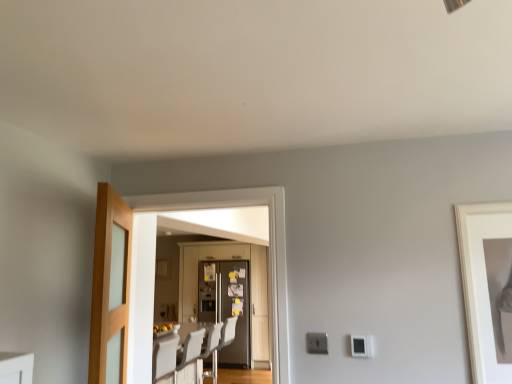
Describe the element at coordinates (228, 307) in the screenshot. The width and height of the screenshot is (512, 384). I see `metallic gray refrigerator at center` at that location.

Measure the distance between white plastic light switch at lower right and camera.

The depth of white plastic light switch at lower right is 5.92 feet.

What do you see at coordinates (222, 345) in the screenshot? I see `white plastic swivel chair at center` at bounding box center [222, 345].

Find the location of a particular element. Image resolution: width=512 pixels, height=384 pixels. white plastic swivel chair at center is located at coordinates (222, 345).

The image size is (512, 384). What are the coordinates of `white glossy dining table at center` in the screenshot? It's located at (192, 351).

Where is `white matte picture frame at right`? white matte picture frame at right is located at coordinates (481, 283).

This screenshot has height=384, width=512. I want to click on matte glass door at center, placed as the 2th door when sorted from front to back, so click(153, 269).

In the scene shown: Does metallic silver refrigerator at center, the 1th door in the back-to-front sequence, touch white matte picture frame at right?

No, metallic silver refrigerator at center, the 1th door in the back-to-front sequence, is not with white matte picture frame at right.

Is point (255, 308) farther from viewer compared to point (472, 251)?

Yes, it is.

Is metallic silver refrigerator at center, placed as the third door when sorted from front to back, turned away from white matte picture frame at right?

No, metallic silver refrigerator at center, placed as the third door when sorted from front to back, is not facing away from white matte picture frame at right.

Visually, is metallic silver refrigerator at center, the 1th door in the back-to-front sequence, positioned to the left or to the right of white matte picture frame at right?

Based on their positions, metallic silver refrigerator at center, the 1th door in the back-to-front sequence, is located to the left of white matte picture frame at right.

Would you consider white plastic light switch at lower right to be distant from metallic gray refrigerator at center?

Yes, white plastic light switch at lower right is far from metallic gray refrigerator at center.

Is white plastic light switch at lower right turned away from metallic gray refrigerator at center?

white plastic light switch at lower right is not turned away from metallic gray refrigerator at center.

Do you think white plastic light switch at lower right is within metallic gray refrigerator at center, or outside of it?

white plastic light switch at lower right is not inside metallic gray refrigerator at center, it's outside.

Between white plastic light switch at lower right and metallic gray refrigerator at center, which one appears on the left side from the viewer's perspective?

Positioned to the left is metallic gray refrigerator at center.

Which is correct: matte glass door at center, placed as the 2th door when sorted from front to back, is inside white glossy dining table at center, or outside of it?

matte glass door at center, placed as the 2th door when sorted from front to back, is located beyond the bounds of white glossy dining table at center.

Which object is thinner, matte glass door at center, the 2th door when ordered from back to front, or white glossy dining table at center?

matte glass door at center, the 2th door when ordered from back to front, is thinner.

Locate an element on the screen. The width and height of the screenshot is (512, 384). furniture below the matte glass door at center, placed as the 2th door when sorted from front to back (from a real-world perspective) is located at coordinates (192, 351).

From the image's perspective, is white plastic light switch at lower right located beneath matte glass door at center, the 2th door when ordered from back to front?

Yes, from the image's perspective, white plastic light switch at lower right is below matte glass door at center, the 2th door when ordered from back to front.

Consider the image. Would you consider white plastic light switch at lower right to be distant from matte glass door at center, placed as the 2th door when sorted from front to back?

No.

Is white plastic light switch at lower right to the left of matte glass door at center, placed as the 2th door when sorted from front to back, from the viewer's perspective?

No, white plastic light switch at lower right is not to the left of matte glass door at center, placed as the 2th door when sorted from front to back.

Is white plastic light switch at lower right not within matte glass door at center, placed as the 2th door when sorted from front to back?

Yes, white plastic light switch at lower right is not within matte glass door at center, placed as the 2th door when sorted from front to back.

Is there a large distance between white plastic chair at center and white plastic light switch at lower right?

Absolutely, white plastic chair at center is distant from white plastic light switch at lower right.

Is white plastic chair at center in front of or behind white plastic light switch at lower right in the image?

Visually, white plastic chair at center is located behind white plastic light switch at lower right.

Find the location of a particular element. chair below the white plastic light switch at lower right (from the image's perspective) is located at coordinates (165, 358).

Is white plastic chair at center shorter than white plastic light switch at lower right?

In fact, white plastic chair at center may be taller than white plastic light switch at lower right.

Is white matte picture frame at right shorter than white glossy dining table at center?

Indeed, white matte picture frame at right has a lesser height compared to white glossy dining table at center.

Where is `furniture behind the white matte picture frame at right`? Image resolution: width=512 pixels, height=384 pixels. furniture behind the white matte picture frame at right is located at coordinates (192, 351).

Is white matte picture frame at right outside of white glossy dining table at center?

Yes, white matte picture frame at right is outside of white glossy dining table at center.

Is white matte picture frame at right not near white glossy dining table at center?

Indeed, white matte picture frame at right is not near white glossy dining table at center.

From a real-world perspective, which is physically above, metallic silver refrigerator at center, the 1th door in the back-to-front sequence, or white glossy dining table at center?

From a 3D spatial view, metallic silver refrigerator at center, the 1th door in the back-to-front sequence, is above.

Are metallic silver refrigerator at center, placed as the third door when sorted from front to back, and white glossy dining table at center beside each other?

metallic silver refrigerator at center, placed as the third door when sorted from front to back, is not next to white glossy dining table at center, and they're not touching.

From the image's perspective, which is below, metallic silver refrigerator at center, placed as the third door when sorted from front to back, or white glossy dining table at center?

white glossy dining table at center appears lower in the image.

Considering the sizes of metallic silver refrigerator at center, placed as the third door when sorted from front to back, and white glossy dining table at center in the image, is metallic silver refrigerator at center, placed as the third door when sorted from front to back, taller or shorter than white glossy dining table at center?

In the image, metallic silver refrigerator at center, placed as the third door when sorted from front to back, appears to be taller than white glossy dining table at center.

Identify the location of the 2nd door positioned below the white matte picture frame at right (from a real-world perspective). The width and height of the screenshot is (512, 384). (250, 288).

In order to click on light switch on the right of metallic gray refrigerator at center in this screenshot , I will do `click(362, 346)`.

Based on their spatial positions, is light wood/glass door at left, which is the first door from front to back, or metallic gray refrigerator at center closer to white glossy dining table at center?

Among the two, metallic gray refrigerator at center is located nearer to white glossy dining table at center.

Looking at the image, which one is located further to metallic gray refrigerator at center, metallic silver refrigerator at center, placed as the third door when sorted from front to back, or white plastic swivel chair at center?

white plastic swivel chair at center.

Looking at the image, which one is located further to white glossy dining table at center, white matte picture frame at right or matte glass door at center, the 2th door when ordered from back to front?

Among the two, white matte picture frame at right is located further to white glossy dining table at center.

From the picture: Looking at the image, which one is located further to white plastic light switch at lower right, metallic gray refrigerator at center or white plastic swivel chair at center?

metallic gray refrigerator at center lies further to white plastic light switch at lower right than the other object.

Estimate the real-world distances between objects in this image. Which object is further from metallic gray refrigerator at center, white glossy dining table at center or metallic silver refrigerator at center, the 1th door in the back-to-front sequence?

Based on the image, white glossy dining table at center appears to be further to metallic gray refrigerator at center.

From the image, which object appears to be nearer to metallic silver refrigerator at center, placed as the third door when sorted from front to back, metallic gray refrigerator at center or matte glass door at center, the 2th door when ordered from back to front?

The object closer to metallic silver refrigerator at center, placed as the third door when sorted from front to back, is metallic gray refrigerator at center.

Based on their spatial positions, is metallic silver refrigerator at center, the 1th door in the back-to-front sequence, or white matte picture frame at right closer to light wood/glass door at left, which is the 3th door from back to front?

Among the two, white matte picture frame at right is located nearer to light wood/glass door at left, which is the 3th door from back to front.

Estimate the real-world distances between objects in this image. Which object is further from white plastic light switch at lower right, light wood/glass door at left, which is the first door from front to back, or white glossy dining table at center?

white glossy dining table at center is further to white plastic light switch at lower right.

I want to click on light switch between light wood/glass door at left, which is the first door from front to back, and white plastic chair at center in the front-back direction, so click(362, 346).

Locate an element on the screen. chair between light wood/glass door at left, which is the first door from front to back, and metallic silver refrigerator at center, placed as the third door when sorted from front to back, along the z-axis is located at coordinates click(165, 358).

What are the coordinates of `light switch between light wood/glass door at left, which is the 3th door from back to front, and white plastic swivel chair at center in the front-back direction` in the screenshot? It's located at (362, 346).

Where is `furniture positioned between white matte picture frame at right and metallic silver refrigerator at center, placed as the third door when sorted from front to back, from near to far`? Image resolution: width=512 pixels, height=384 pixels. furniture positioned between white matte picture frame at right and metallic silver refrigerator at center, placed as the third door when sorted from front to back, from near to far is located at coordinates (192, 351).